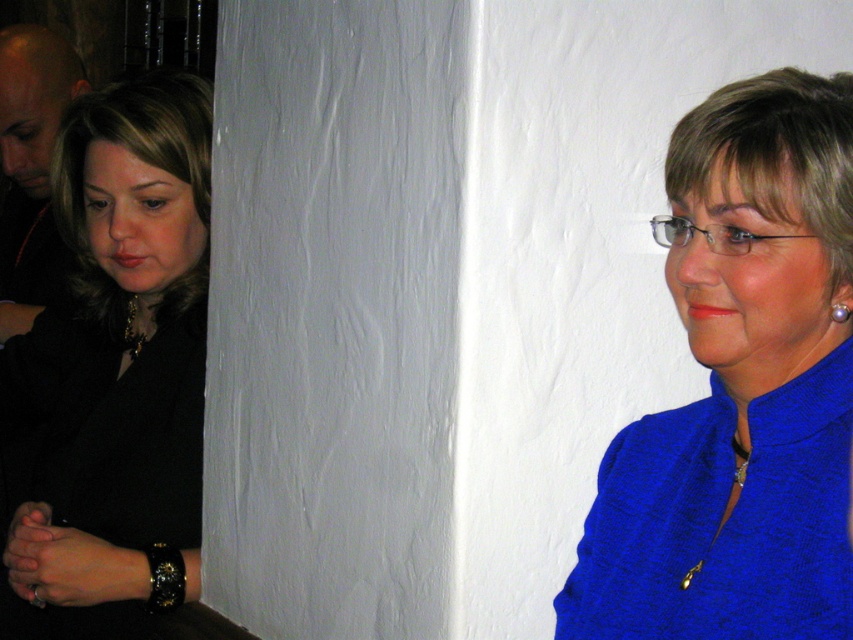
Can you confirm if black leather jacket at left is smaller than pearlelegantearring at upper right?

Actually, black leather jacket at left might be larger than pearlelegantearring at upper right.

Locate an element on the screen. black leather jacket at left is located at coordinates (115, 365).

Find the location of a particular element. The image size is (853, 640). black leather jacket at left is located at coordinates (115, 365).

Consider the image. Is blue fabric at upper right above black leather bracelet at lower left?

Yes, blue fabric at upper right is above black leather bracelet at lower left.

Can you confirm if blue fabric at upper right is smaller than black leather bracelet at lower left?

No, blue fabric at upper right is not smaller than black leather bracelet at lower left.

Does point (766, 396) lie behind point (149, 545)?

That is False.

At what (x,y) coordinates should I click in order to perform the action: click on blue fabric at upper right. Please return your answer as a coordinate pair (x, y). Looking at the image, I should click on (740, 387).

Is blue fabric at upper right to the left of black leather jacket at left from the viewer's perspective?

Incorrect, blue fabric at upper right is not on the left side of black leather jacket at left.

The image size is (853, 640). I want to click on blue fabric at upper right, so 740,387.

Between point (825, 456) and point (73, 586), which one is positioned in front?

Point (825, 456)

What are the coordinates of `blue fabric at upper right` in the screenshot? It's located at (740, 387).